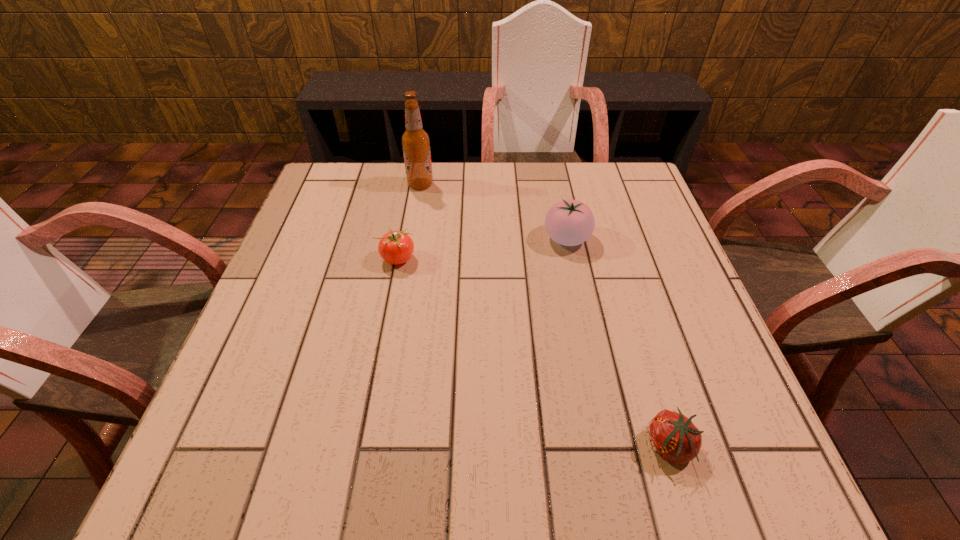
This screenshot has width=960, height=540. Identify the location of the closest object to the nearest tomato. (569, 222).

Locate an element on the screen. The height and width of the screenshot is (540, 960). the closest tomato to the farthest object is located at coordinates (395, 247).

Choose which tomato is the second nearest neighbor to the second tallest object. Please provide its 2D coordinates. Your answer should be formatted as a tuple, i.e. [(x, y)], where the tuple contains the x and y coordinates of a point satisfying the conditions above.

[(673, 436)]

Image resolution: width=960 pixels, height=540 pixels. In order to click on free point that satisfies the following two spatial constraints: 1. on the front label of the farthest object; 2. on the right side of the second tallest object in this screenshot , I will do `click(412, 239)`.

Image resolution: width=960 pixels, height=540 pixels. Identify the location of free point that satisfies the following two spatial constraints: 1. on the front label of the shortest tomato; 2. on the left side of the farthest object. (377, 447).

The height and width of the screenshot is (540, 960). I want to click on free region that satisfies the following two spatial constraints: 1. on the front label of the shortest object; 2. on the right side of the beer bottle, so click(377, 447).

At what (x,y) coordinates should I click in order to perform the action: click on free point that satisfies the following two spatial constraints: 1. on the front side of the nearest object; 2. on the right side of the tallest tomato. Please return your answer as a coordinate pair (x, y). This screenshot has width=960, height=540. Looking at the image, I should click on (610, 447).

At what (x,y) coordinates should I click in order to perform the action: click on vacant space that satisfies the following two spatial constraints: 1. on the front label of the tallest object; 2. on the left side of the shortest tomato. Please return your answer as a coordinate pair (x, y). Looking at the image, I should click on (377, 447).

The image size is (960, 540). I want to click on free space that satisfies the following two spatial constraints: 1. on the front side of the leftmost tomato; 2. on the left side of the shortest object, so click(362, 447).

In order to click on blank area in the image that satisfies the following two spatial constraints: 1. on the front label of the nearest object; 2. on the left side of the farthest object in this screenshot , I will do `click(377, 447)`.